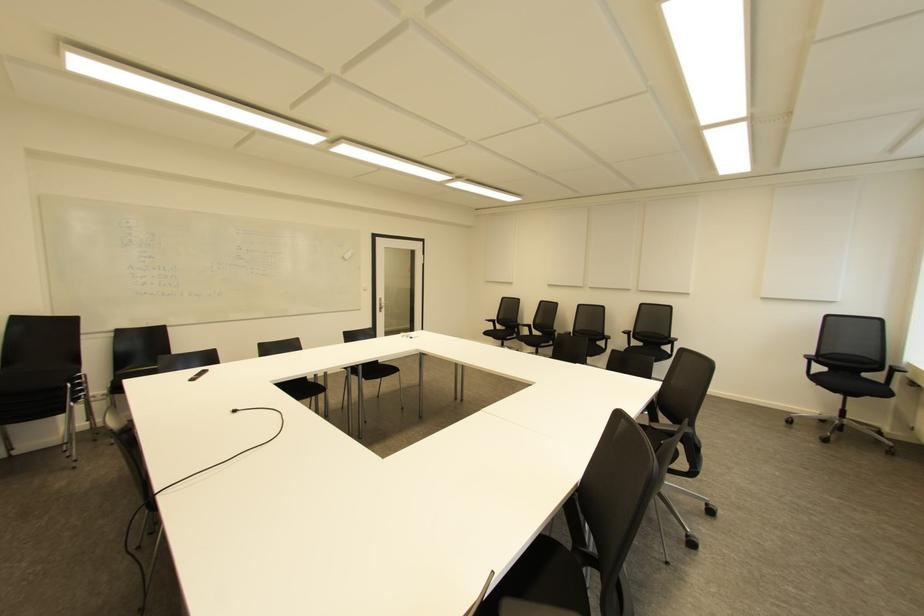
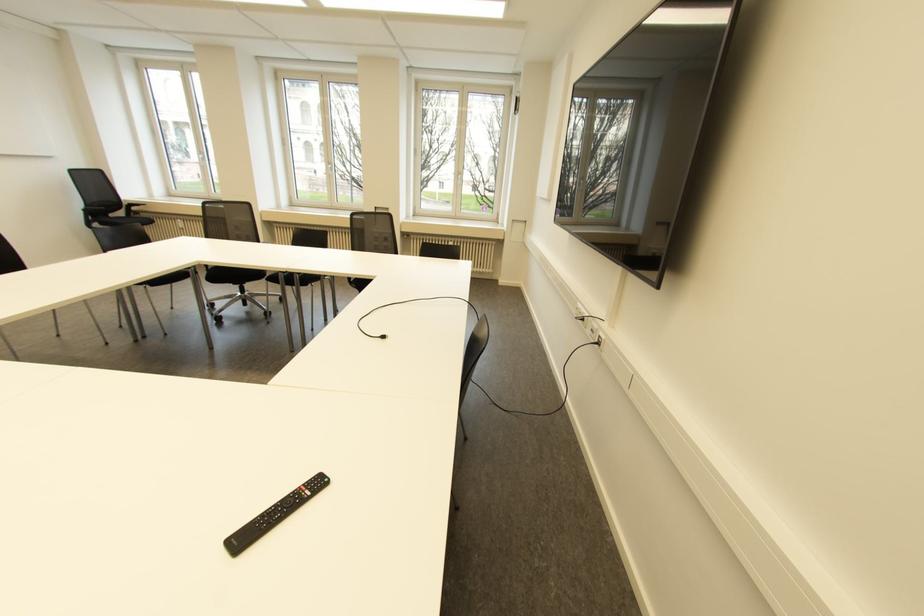
The point at [809,360] is marked in the first image. Where is the corresponding point in the second image?

(86, 211)